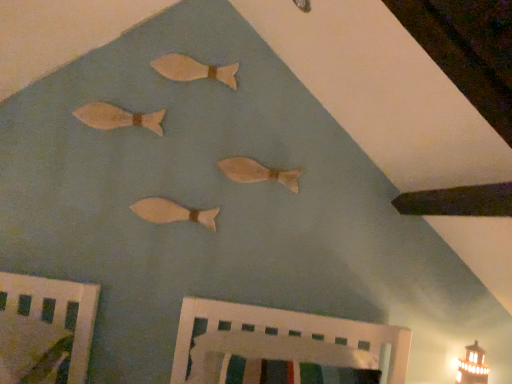
Question: Should I look upward or downward to see wooden fish at upper left, which appears as the second fish when viewed from the top?

Choices:
 (A) up
 (B) down

Answer: (A)

Question: Which direction should I rotate to look at matte wooden fish at center, which ranks as the third fish in top-to-bottom order, — up or down?

Choices:
 (A) up
 (B) down

Answer: (A)

Question: Does matte wooden fish at center, which ranks as the third fish in top-to-bottom order, have a larger size compared to white painted wood crib at lower center, marked as the 1th furniture in a right-to-left arrangement?

Choices:
 (A) no
 (B) yes

Answer: (A)

Question: Does matte wooden fish at center, arranged as the second fish when ordered from the bottom, have a lesser height compared to white painted wood crib at lower center, marked as the 1th furniture in a right-to-left arrangement?

Choices:
 (A) yes
 (B) no

Answer: (A)

Question: Is matte wooden fish at center, which ranks as the third fish in top-to-bottom order, at the right side of white painted wood crib at lower center, the second furniture from the left?

Choices:
 (A) no
 (B) yes

Answer: (A)

Question: From the image's perspective, would you say matte wooden fish at center, arranged as the second fish when ordered from the bottom, is shown under white painted wood crib at lower center, the second furniture from the left?

Choices:
 (A) no
 (B) yes

Answer: (A)

Question: Does matte wooden fish at center, which ranks as the third fish in top-to-bottom order, have a smaller size compared to white painted wood crib at lower center, marked as the 1th furniture in a right-to-left arrangement?

Choices:
 (A) yes
 (B) no

Answer: (A)

Question: Can you confirm if matte wooden fish at center, which ranks as the third fish in top-to-bottom order, is thinner than white painted wood crib at lower center, the second furniture from the left?

Choices:
 (A) yes
 (B) no

Answer: (A)

Question: Is white painted wood crib at lower center, the second furniture from the left, further to camera compared to matte wooden fish at center, which ranks as the third fish in top-to-bottom order?

Choices:
 (A) yes
 (B) no

Answer: (B)

Question: Is white painted wood crib at lower center, the second furniture from the left, shorter than matte wooden fish at center, which ranks as the third fish in top-to-bottom order?

Choices:
 (A) yes
 (B) no

Answer: (B)

Question: From a real-world perspective, is white painted wood crib at lower center, the second furniture from the left, beneath matte wooden fish at center, arranged as the second fish when ordered from the bottom?

Choices:
 (A) no
 (B) yes

Answer: (B)

Question: Is white painted wood crib at lower center, the second furniture from the left, facing towards matte wooden fish at center, arranged as the second fish when ordered from the bottom?

Choices:
 (A) no
 (B) yes

Answer: (A)

Question: Is white painted wood crib at lower center, marked as the 1th furniture in a right-to-left arrangement, not close to matte wooden fish at center, which ranks as the third fish in top-to-bottom order?

Choices:
 (A) no
 (B) yes

Answer: (A)

Question: Could matte wooden fish at center, arranged as the second fish when ordered from the bottom, be considered to be inside white painted wood crib at lower center, marked as the 1th furniture in a right-to-left arrangement?

Choices:
 (A) no
 (B) yes

Answer: (A)

Question: Considering the relative positions of wooden fish at upper center, which appears as the fourth fish when ordered from the bottom, and wooden bed frame at lower left, the second furniture when ordered from right to left, in the image provided, is wooden fish at upper center, which appears as the fourth fish when ordered from the bottom, in front of wooden bed frame at lower left, the second furniture when ordered from right to left,?

Choices:
 (A) no
 (B) yes

Answer: (A)